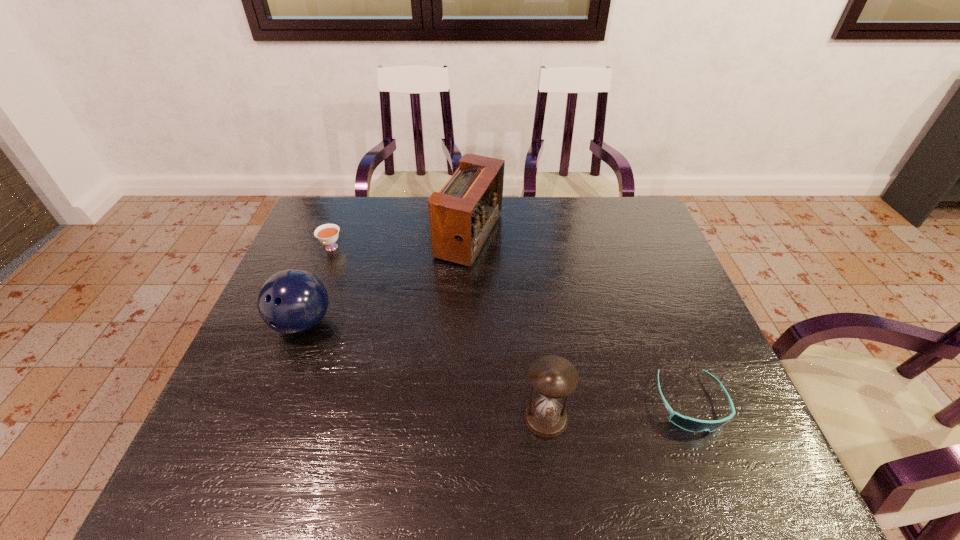
In order to click on vacant space located 0.350m on the side of the second shortest object with the handle in this screenshot , I will do `click(291, 352)`.

Where is `vacant space located 0.070m on the front-facing side of the sunglasses`? This screenshot has width=960, height=540. vacant space located 0.070m on the front-facing side of the sunglasses is located at coordinates (716, 471).

I want to click on radio receiver that is at the far edge, so click(x=461, y=216).

I want to click on teacup at the far edge, so click(327, 234).

Identify the location of bowling ball that is at the left edge. (292, 301).

The height and width of the screenshot is (540, 960). Identify the location of teacup present at the left edge. (327, 234).

Identify the location of object at the right edge. Image resolution: width=960 pixels, height=540 pixels. (687, 423).

Identify the location of object at the far left corner. (327, 234).

At what (x,y) coordinates should I click in order to perform the action: click on vacant position at the far edge of the desktop. Please return your answer as a coordinate pair (x, y). The width and height of the screenshot is (960, 540). Looking at the image, I should click on (584, 207).

This screenshot has width=960, height=540. What are the coordinates of `vacant area at the near edge` in the screenshot? It's located at coord(527,471).